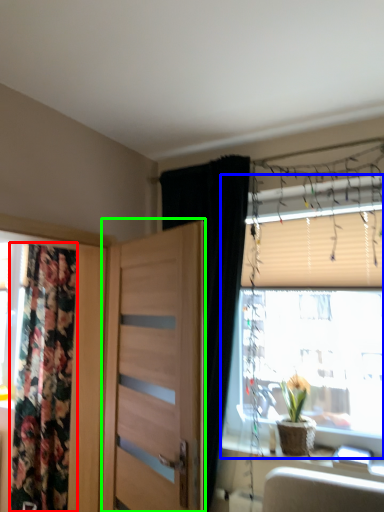
Question: Considering the real-world distances, which object is closest to curtain (highlighted by a red box)? window (highlighted by a blue box) or door (highlighted by a green box).

Choices:
 (A) window
 (B) door

Answer: (B)